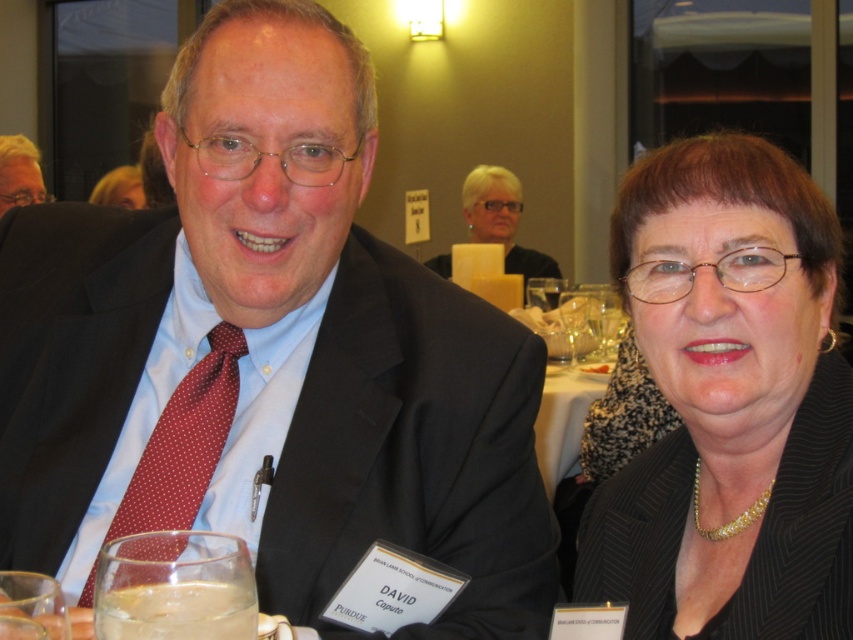
Does matte black jacket at upper center have a greater height compared to blonde hair at upper left?

Yes, matte black jacket at upper center is taller than blonde hair at upper left.

Identify the location of matte black jacket at upper center. (502, 220).

Is point (463, 202) less distant than point (144, 196)?

No, it is not.

I want to click on matte black jacket at upper center, so click(x=502, y=220).

Who is more distant from viewer, [474,198] or [4,582]?

The point [474,198] is more distant.

Does point (450, 275) lie behind point (18, 589)?

That is True.

Locate an element on the screen. Image resolution: width=853 pixels, height=640 pixels. matte black jacket at upper center is located at coordinates (502, 220).

Is black textured blazer at center smaller than matte black jacket at upper center?

Yes, black textured blazer at center is smaller than matte black jacket at upper center.

Between point (683, 400) and point (508, 220), which one is positioned behind?

Positioned behind is point (508, 220).

At what (x,y) coordinates should I click in order to perform the action: click on black textured blazer at center. Please return your answer as a coordinate pair (x, y). Looking at the image, I should click on (729, 404).